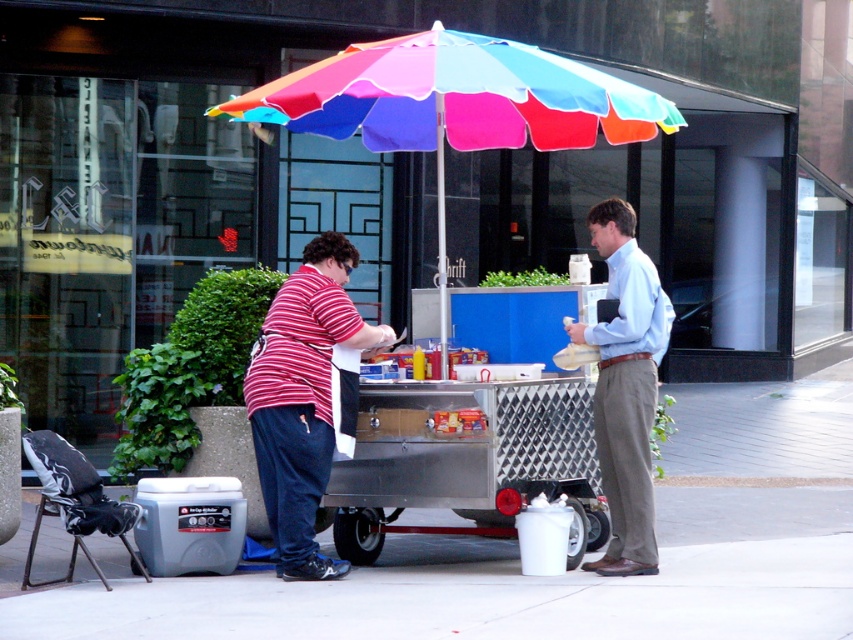
Question: Which of the following is the closest to the observer?

Choices:
 (A) rainbow fabric umbrella at center
 (B) light blue shirt at center
 (C) striped cotton shirt at center

Answer: (A)

Question: In this image, where is rainbow fabric umbrella at center located relative to striped cotton shirt at center?

Choices:
 (A) left
 (B) right

Answer: (B)

Question: Estimate the real-world distances between objects in this image. Which object is farther from the rainbow fabric umbrella at center?

Choices:
 (A) light blue shirt at center
 (B) striped cotton shirt at center

Answer: (B)

Question: Is rainbow fabric umbrella at center above striped cotton shirt at center?

Choices:
 (A) yes
 (B) no

Answer: (A)

Question: Can you confirm if striped cotton shirt at center is bigger than light blue shirt at center?

Choices:
 (A) yes
 (B) no

Answer: (B)

Question: Based on their relative distances, which object is farther from the striped cotton shirt at center?

Choices:
 (A) rainbow fabric umbrella at center
 (B) light blue shirt at center

Answer: (A)